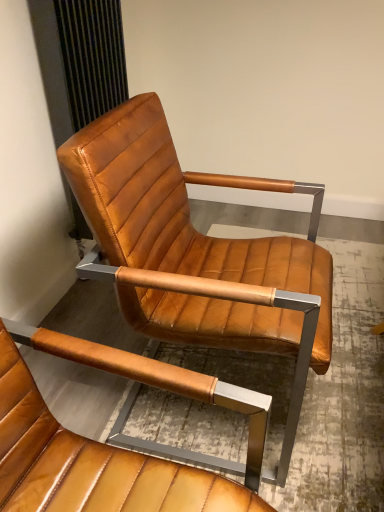
What do you see at coordinates (197, 252) in the screenshot? I see `cognac leather chair at center` at bounding box center [197, 252].

The height and width of the screenshot is (512, 384). Identify the location of cognac leather chair at center. (197, 252).

Image resolution: width=384 pixels, height=512 pixels. In order to click on cognac leather chair at center in this screenshot , I will do `click(197, 252)`.